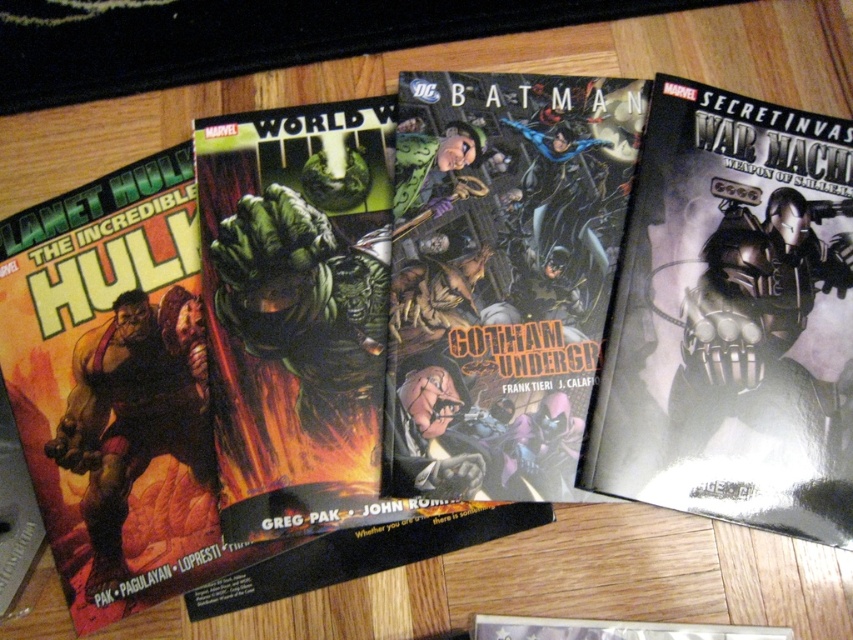
Question: Does metallic silver robot at right appear over rubberized green hulk at left?

Choices:
 (A) no
 (B) yes

Answer: (B)

Question: From the image, what is the correct spatial relationship of metallic silver robot at right in relation to rubberized green hulk at left?

Choices:
 (A) left
 (B) right

Answer: (B)

Question: Where is metallic silver robot at right located in relation to rubberized green hulk at left in the image?

Choices:
 (A) below
 (B) above

Answer: (B)

Question: Which object appears closest to the camera in this image?

Choices:
 (A) rubberized green hulk at left
 (B) metallic silver robot at right

Answer: (B)

Question: Among these points, which one is farthest from the camera?

Choices:
 (A) (177, 305)
 (B) (637, 296)

Answer: (A)

Question: Which point is farther to the camera?

Choices:
 (A) (154, 419)
 (B) (680, 292)

Answer: (A)